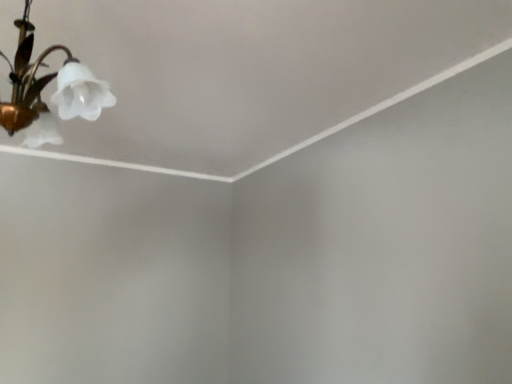
Find the location of a particular element. The width and height of the screenshot is (512, 384). white frosted glass lamp at upper left is located at coordinates (42, 88).

The height and width of the screenshot is (384, 512). Describe the element at coordinates (42, 88) in the screenshot. I see `white frosted glass lamp at upper left` at that location.

The height and width of the screenshot is (384, 512). What are the coordinates of `white frosted glass lamp at upper left` in the screenshot? It's located at (42, 88).